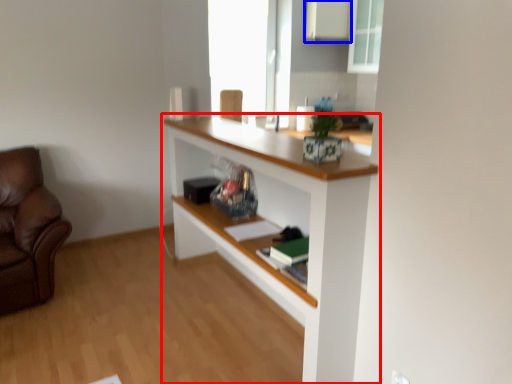
Question: Which object is further to the camera taking this photo, shelf (highlighted by a red box) or cabinetry (highlighted by a blue box)?

Choices:
 (A) shelf
 (B) cabinetry

Answer: (B)